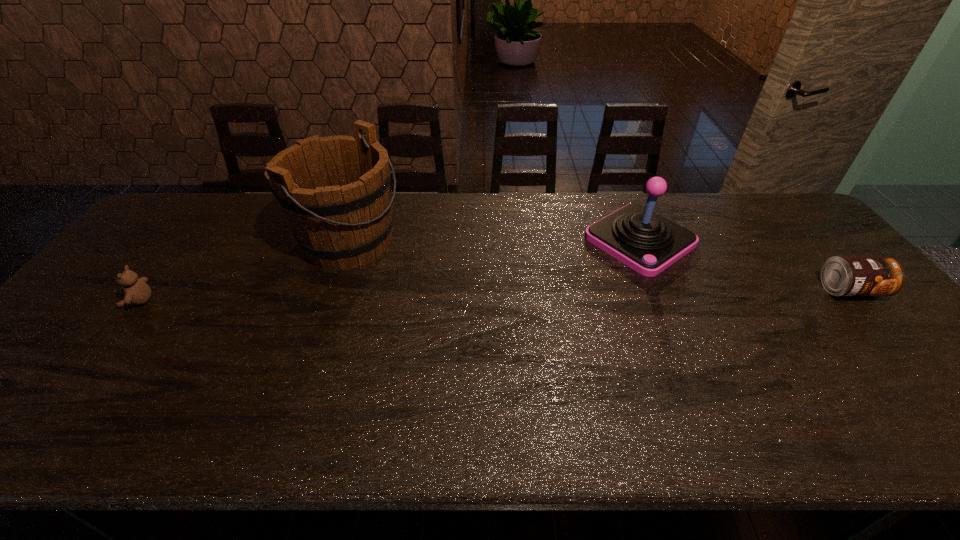
The height and width of the screenshot is (540, 960). In order to click on blank region between the second object from right to left and the third object from right to left in this screenshot , I will do `click(494, 241)`.

This screenshot has height=540, width=960. Identify the location of vacant point located between the joystick and the can. (745, 265).

Where is `vacant area between the second object from left to right and the second tallest object`? Image resolution: width=960 pixels, height=540 pixels. vacant area between the second object from left to right and the second tallest object is located at coordinates (494, 241).

Locate which object is the third closest to the second tallest object. Please provide its 2D coordinates. Your answer should be formatted as a tuple, i.e. [(x, y)], where the tuple contains the x and y coordinates of a point satisfying the conditions above.

[(137, 292)]

Identify which object is located as the second nearest to the third object from right to left. Please provide its 2D coordinates. Your answer should be formatted as a tuple, i.e. [(x, y)], where the tuple contains the x and y coordinates of a point satisfying the conditions above.

[(648, 243)]